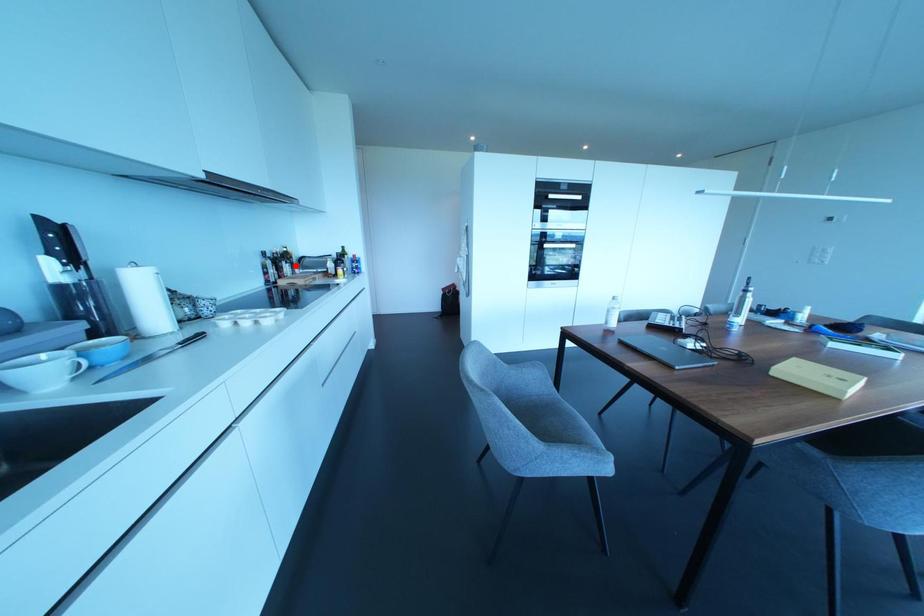
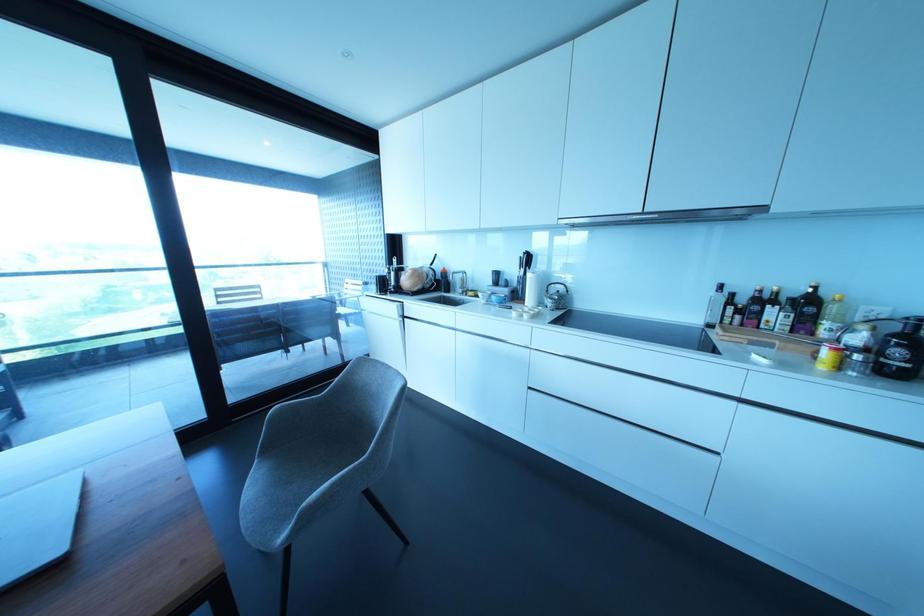
The point at the highlighted location is marked in the first image. Where is the corresponding point in the second image?

(825, 323)